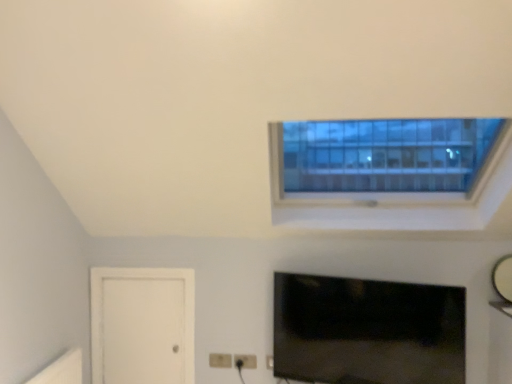
Where is `white plastic electric outlet at lower center`? white plastic electric outlet at lower center is located at coordinates (245, 361).

Where is `glossy silver mirror at upper right`? This screenshot has height=384, width=512. glossy silver mirror at upper right is located at coordinates (503, 278).

From the image's perspective, is glossy silver mirror at upper right on white matte door at lower left?

Indeed, from the image's perspective, glossy silver mirror at upper right is shown above white matte door at lower left.

From a real-world perspective, who is located higher, glossy silver mirror at upper right or white matte door at lower left?

From a 3D spatial view, glossy silver mirror at upper right is above.

This screenshot has width=512, height=384. In the image, there is a glossy silver mirror at upper right. What are the coordinates of `door below it (from the image's perspective)` in the screenshot? It's located at tap(142, 325).

Can you tell me how much glossy silver mirror at upper right and white matte door at lower left differ in facing direction?

They differ by 1.29 degrees in their facing directions.

From the image's perspective, is white matte door at lower left above or below glossy silver mirror at upper right?

Based on their image positions, white matte door at lower left is located beneath glossy silver mirror at upper right.

Which is closer, (142, 374) or (504, 298)?

Point (504, 298)

Between white matte door at lower left and glossy silver mirror at upper right, which one appears on the left side from the viewer's perspective?

Positioned to the left is white matte door at lower left.

Which point is more distant from viewer, (288,323) or (499,291)?

The point (288,323) is behind.

Is matte black tv at lower center oriented towards glossy silver mirror at upper right?

No, matte black tv at lower center is not oriented towards glossy silver mirror at upper right.

The height and width of the screenshot is (384, 512). Find the location of `television on the left of glossy silver mirror at upper right`. television on the left of glossy silver mirror at upper right is located at coordinates (367, 331).

Relative to glossy silver mirror at upper right, is matte black tv at lower center in front or behind?

Clearly, matte black tv at lower center is in front of glossy silver mirror at upper right.

Which object is thinner, matte black tv at lower center or white matte door at lower left?

white matte door at lower left is thinner.

Is white matte door at lower left surrounded by matte black tv at lower center?

No, white matte door at lower left is not a part of matte black tv at lower center.

What's the angular difference between matte black tv at lower center and white matte door at lower left's facing directions?

18.6 degrees separate the facing orientations of matte black tv at lower center and white matte door at lower left.

From the image's perspective, does matte black tv at lower center appear lower than white matte door at lower left?

No, from the image's perspective, matte black tv at lower center is not below white matte door at lower left.

From the image's perspective, is white matte door at lower left located above white plastic electric outlet at lower center?

Indeed, from the image's perspective, white matte door at lower left is shown above white plastic electric outlet at lower center.

Could you tell me if white matte door at lower left is turned towards white plastic electric outlet at lower center?

No, white matte door at lower left is not oriented towards white plastic electric outlet at lower center.

Does point (191, 284) appear closer or farther from the camera than point (255, 361)?

Point (191, 284) appears to be farther away from the viewer than point (255, 361).

Is white plastic electric outlet at lower center turned away from white matte door at lower left?

No, white matte door at lower left is not at the back of white plastic electric outlet at lower center.

This screenshot has width=512, height=384. I want to click on electric outlet below the white matte door at lower left (from a real-world perspective), so click(x=245, y=361).

Considering the relative sizes of white plastic electric outlet at lower center and white matte door at lower left in the image provided, is white plastic electric outlet at lower center shorter than white matte door at lower left?

Indeed, white plastic electric outlet at lower center has a lesser height compared to white matte door at lower left.

From a real-world perspective, which object stands above the other?

white matte door at lower left.

Considering their positions, is white plastic electric outlet at lower center located in front of or behind matte black tv at lower center?

→ white plastic electric outlet at lower center is positioned farther from the viewer than matte black tv at lower center.

In the scene shown: Are white plastic electric outlet at lower center and matte black tv at lower center making contact?

No, white plastic electric outlet at lower center is not touching matte black tv at lower center.

Is white plastic electric outlet at lower center surrounding matte black tv at lower center?

That's incorrect, matte black tv at lower center is not inside white plastic electric outlet at lower center.

Would you say white plastic electric outlet at lower center is to the left or to the right of matte black tv at lower center in the picture?

Based on their positions, white plastic electric outlet at lower center is located to the left of matte black tv at lower center.

Where is `mirror located in front of the white matte door at lower left`? This screenshot has width=512, height=384. mirror located in front of the white matte door at lower left is located at coordinates (503, 278).

Locate an element on the screen. The width and height of the screenshot is (512, 384). door behind the glossy silver mirror at upper right is located at coordinates (142, 325).

From the image, which object appears to be farther from glossy silver mirror at upper right, matte black tv at lower center or white plastic electric outlet at lower center?

white plastic electric outlet at lower center is further to glossy silver mirror at upper right.

When comparing their distances from matte black tv at lower center, does white matte door at lower left or glossy silver mirror at upper right seem closer?

glossy silver mirror at upper right is closer to matte black tv at lower center.

Based on their spatial positions, is matte black tv at lower center or glossy silver mirror at upper right further from white plastic electric outlet at lower center?

glossy silver mirror at upper right lies further to white plastic electric outlet at lower center than the other object.

Looking at the image, which one is located further to matte black tv at lower center, white plastic electric outlet at lower center or glossy silver mirror at upper right?

glossy silver mirror at upper right.

Which object lies nearer to the anchor point glossy silver mirror at upper right, white matte door at lower left or matte black tv at lower center?

matte black tv at lower center is closer to glossy silver mirror at upper right.

In the scene shown: When comparing their distances from white plastic electric outlet at lower center, does white matte door at lower left or matte black tv at lower center seem closer?

Based on the image, white matte door at lower left appears to be nearer to white plastic electric outlet at lower center.

From the picture: Based on their spatial positions, is matte black tv at lower center or white matte door at lower left closer to glossy silver mirror at upper right?

matte black tv at lower center is positioned closer to the anchor glossy silver mirror at upper right.

When comparing their distances from matte black tv at lower center, does white matte door at lower left or white plastic electric outlet at lower center seem further?

white matte door at lower left is further to matte black tv at lower center.

Find the location of `television between white plastic electric outlet at lower center and glossy silver mirror at upper right in the horizontal direction`. television between white plastic electric outlet at lower center and glossy silver mirror at upper right in the horizontal direction is located at coordinates (367, 331).

Where is `electric outlet situated between white matte door at lower left and glossy silver mirror at upper right from left to right`? The width and height of the screenshot is (512, 384). electric outlet situated between white matte door at lower left and glossy silver mirror at upper right from left to right is located at coordinates (245, 361).

You are a GUI agent. You are given a task and a screenshot of the screen. Output one action in this format:
    pyautogui.click(x=<x>, y=<y>)
    Task: Click on the electric outlet situated between white matte door at lower left and matte black tv at lower center from left to right
    The image size is (512, 384).
    Given the screenshot: What is the action you would take?
    pyautogui.click(x=245, y=361)

Where is `television situated between white matte door at lower left and glossy silver mirror at upper right from left to right`? The width and height of the screenshot is (512, 384). television situated between white matte door at lower left and glossy silver mirror at upper right from left to right is located at coordinates (367, 331).